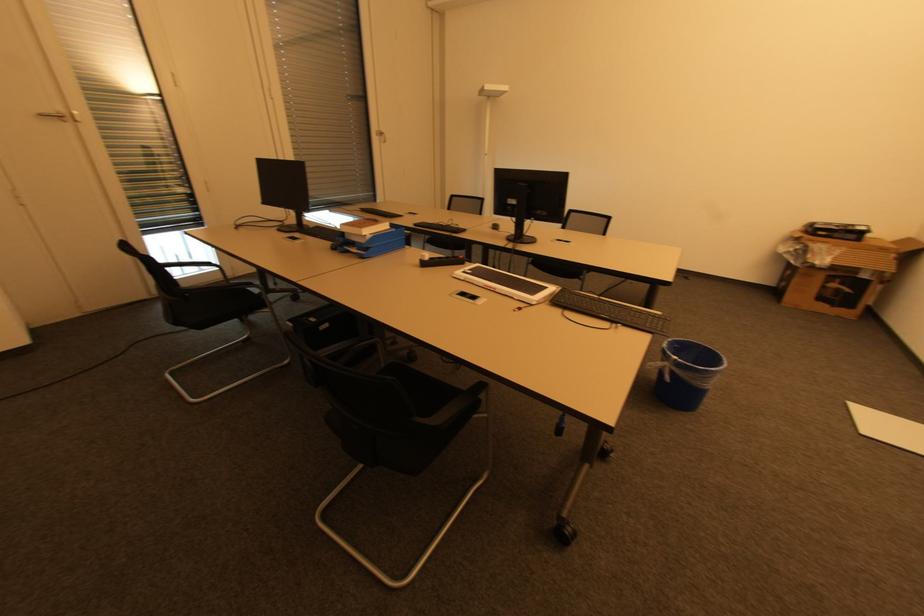
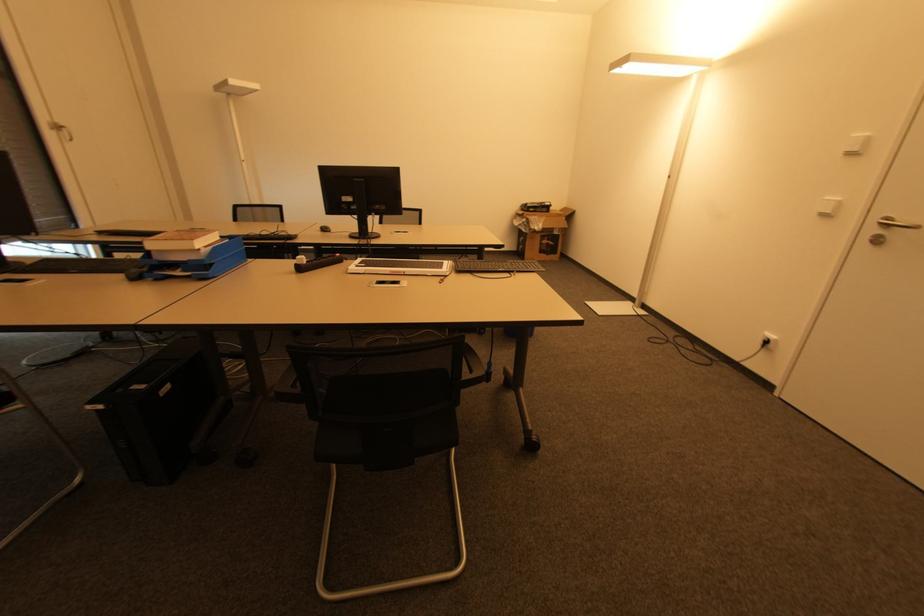
Find the pixel in the second image that matches the point at 356,251 in the first image.

(178, 274)